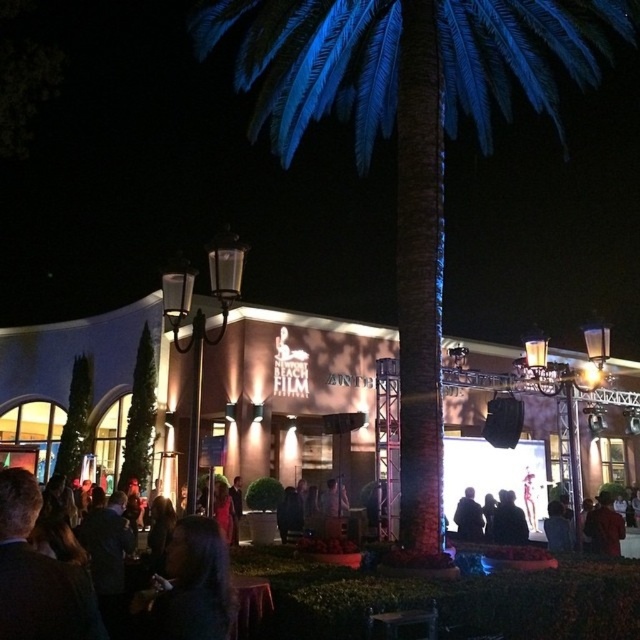
Question: Does velvet red coat at lower right have a smaller size compared to silky black hair at lower center?

Choices:
 (A) no
 (B) yes

Answer: (A)

Question: Which point appears closest to the camera in this image?

Choices:
 (A) (33, 500)
 (B) (464, 540)
 (C) (577, 60)

Answer: (A)

Question: Which is nearer to the silky black hair at lower center?

Choices:
 (A) velvet red coat at lower right
 (B) dark gray suit at lower left

Answer: (A)

Question: Does velvet red coat at lower right appear over dark blue fabric jacket at center?

Choices:
 (A) no
 (B) yes

Answer: (A)

Question: Based on their relative distances, which object is nearer to the velvet red coat at lower right?

Choices:
 (A) silky black hair at lower center
 (B) dark gray suit at lower left
 (C) blue artificial palm tree at center

Answer: (A)

Question: Does blue artificial palm tree at center have a lesser width compared to dark blue fabric jacket at center?

Choices:
 (A) no
 (B) yes

Answer: (A)